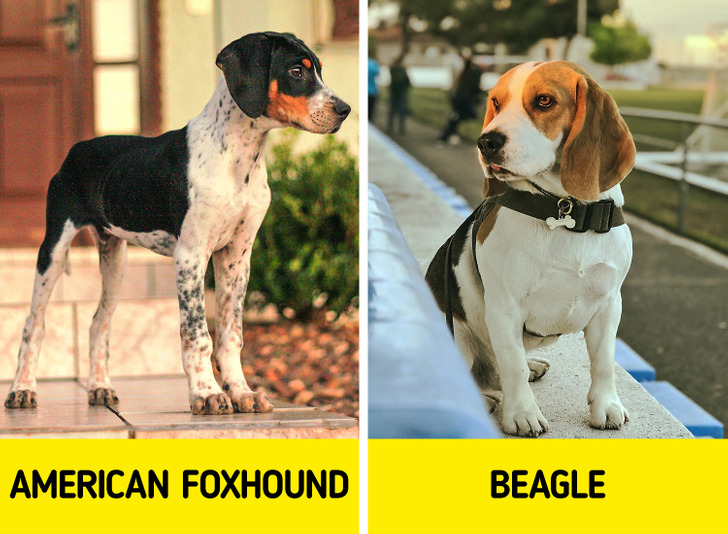
This screenshot has height=534, width=728. I want to click on window, so tap(343, 19).